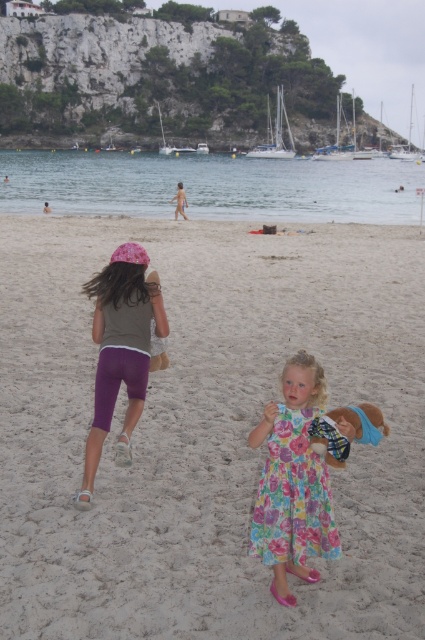
You are a photographer trying to capture the children playing on the beach. You notice the light beige sand at center and the matte purple shorts at left. Which object is closer to the camera?

The light beige sand at center is closer to the camera because it is in front of the matte purple shorts at left.